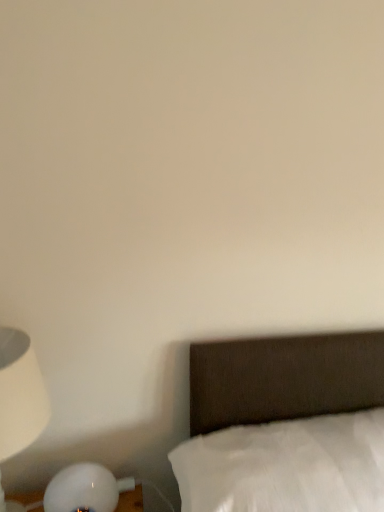
Question: From the image's perspective, is white cotton bed at lower right above or below white matte lamp at left?

Choices:
 (A) below
 (B) above

Answer: (A)

Question: Would you say white cotton bed at lower right is to the left or to the right of white matte lamp at left in the picture?

Choices:
 (A) left
 (B) right

Answer: (B)

Question: Is point (226, 430) positioned closer to the camera than point (6, 426)?

Choices:
 (A) farther
 (B) closer

Answer: (A)

Question: From a real-world perspective, is white matte lamp at left positioned above or below white cotton bed at lower right?

Choices:
 (A) above
 (B) below

Answer: (A)

Question: Considering their positions, is white matte lamp at left located in front of or behind white cotton bed at lower right?

Choices:
 (A) front
 (B) behind

Answer: (B)

Question: Considering the positions of white matte lamp at left and white cotton bed at lower right in the image, is white matte lamp at left taller or shorter than white cotton bed at lower right?

Choices:
 (A) short
 (B) tall

Answer: (B)

Question: Considering the positions of white matte lamp at left and white cotton bed at lower right in the image, is white matte lamp at left bigger or smaller than white cotton bed at lower right?

Choices:
 (A) big
 (B) small

Answer: (B)